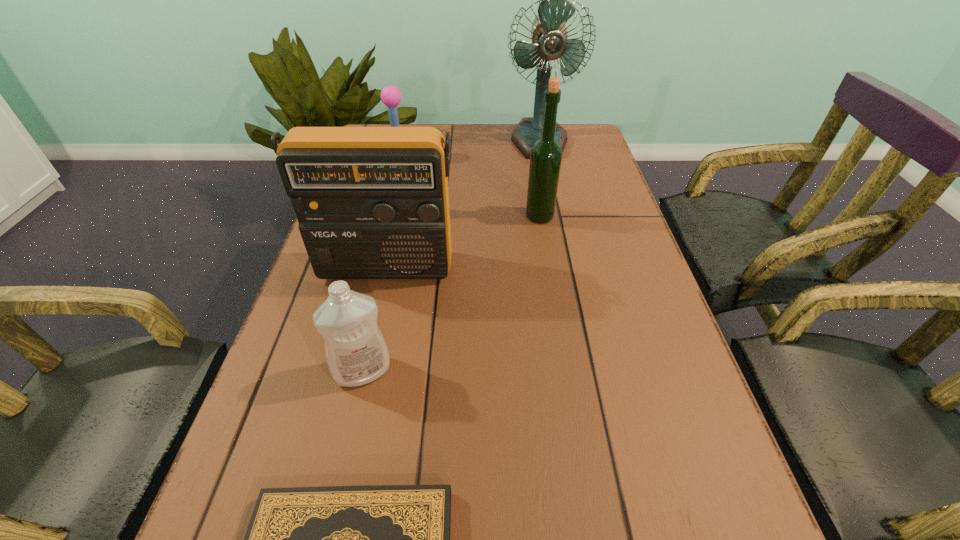
Where is `fan`? The width and height of the screenshot is (960, 540). fan is located at coordinates (549, 34).

In order to click on liquor in this screenshot , I will do `click(546, 155)`.

You are a GUI agent. You are given a task and a screenshot of the screen. Output one action in this format:
    pyautogui.click(x=<x>, y=<y>)
    Task: Click on the third nearest object
    This screenshot has height=540, width=960.
    Given the screenshot: What is the action you would take?
    pyautogui.click(x=372, y=202)

Locate an element on the screen. This screenshot has height=540, width=960. joystick is located at coordinates (390, 95).

In order to click on the second nearest object in this screenshot , I will do pyautogui.click(x=356, y=352).

The height and width of the screenshot is (540, 960). Find the location of `free space located in front of the tallest object where the wind blows`. free space located in front of the tallest object where the wind blows is located at coordinates (559, 234).

I want to click on free space located on the front of the fourth nearest object, so click(543, 243).

Find the location of `free space located on the front-facing side of the radio receiver`. free space located on the front-facing side of the radio receiver is located at coordinates (355, 403).

Where is `free location located forward from the base of the joystick`? free location located forward from the base of the joystick is located at coordinates (462, 159).

The height and width of the screenshot is (540, 960). I want to click on free point located 0.330m on the back of the fifth farthest object, so click(x=392, y=240).